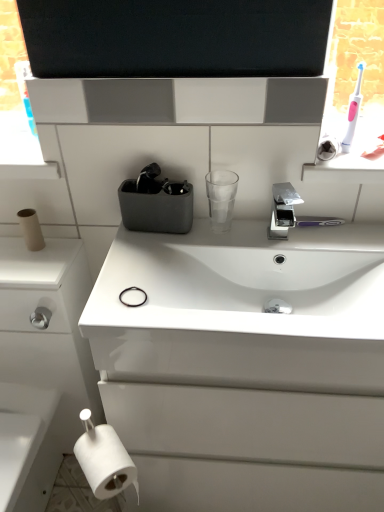
In order to click on vacant space to the right of white cardboard toilet paper at left, which is counted as the first toilet paper, starting from the left in this screenshot , I will do `click(61, 248)`.